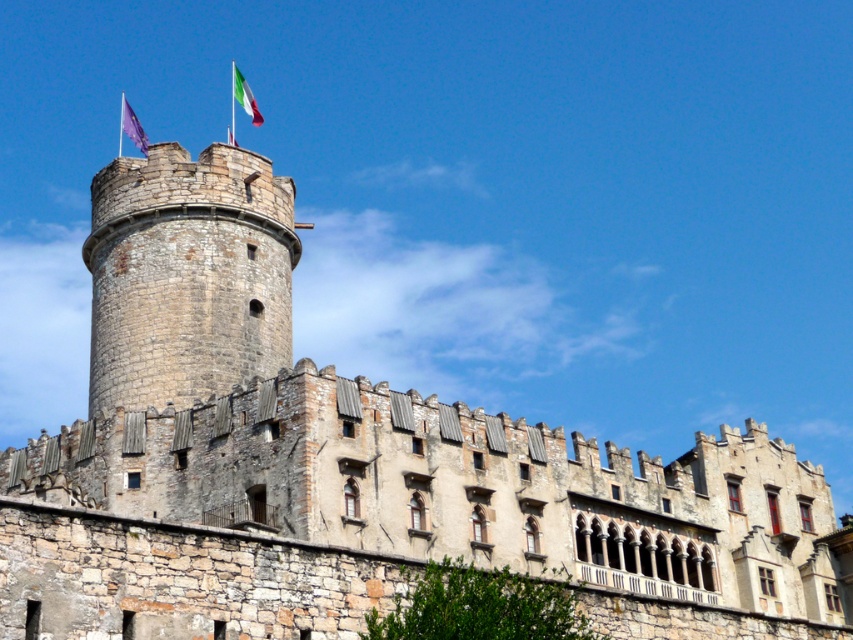
Question: Does rustic stone tower at center have a smaller size compared to purple fabric flag at top?

Choices:
 (A) no
 (B) yes

Answer: (A)

Question: Which is nearer to the rustic stone tower at center?

Choices:
 (A) green fabric flag at top center
 (B) purple fabric flag at top

Answer: (B)

Question: Which point is closer to the camera?

Choices:
 (A) (120, 97)
 (B) (236, 80)
 (C) (244, 266)

Answer: (C)

Question: Does rustic stone tower at center have a smaller size compared to green fabric flag at top center?

Choices:
 (A) yes
 (B) no

Answer: (B)

Question: Among these objects, which one is nearest to the camera?

Choices:
 (A) green fabric flag at top center
 (B) purple fabric flag at top

Answer: (B)

Question: Is purple fabric flag at top bigger than green fabric flag at top center?

Choices:
 (A) yes
 (B) no

Answer: (A)